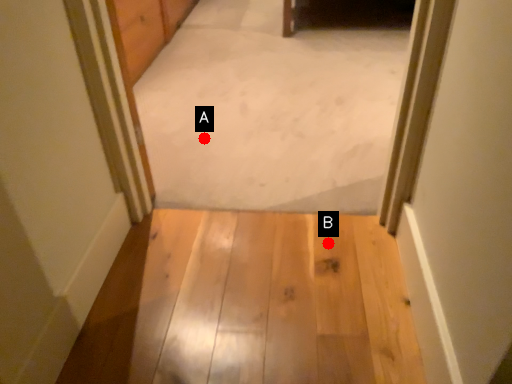
Question: Two points are circled on the image, labeled by A and B beside each circle. Which point is closer to the camera?

Choices:
 (A) A is closer
 (B) B is closer

Answer: (B)